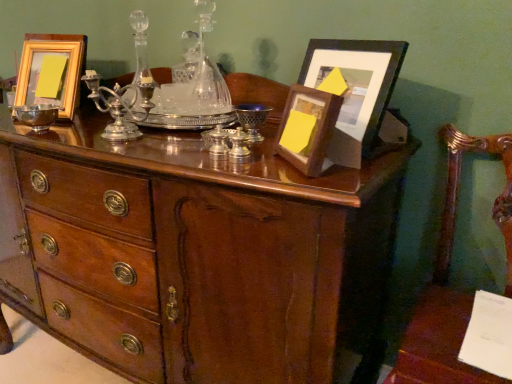
Identify the location of vacant area located to the right-hand side of shiny silver candle holder at center, which appears as the third candle holder when viewed from the left. Image resolution: width=512 pixels, height=384 pixels. (304, 172).